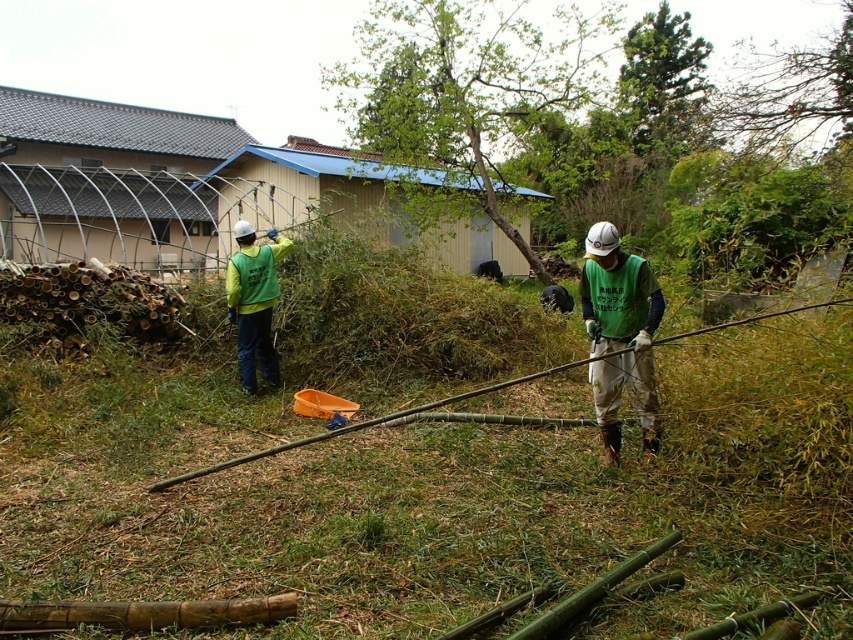
Question: Is brown textured tree at upper right further to the viewer compared to green fabric vest at left?

Choices:
 (A) yes
 (B) no

Answer: (A)

Question: Which point is farther to the camera?

Choices:
 (A) (837, 36)
 (B) (274, 272)
 (C) (676, 614)

Answer: (A)

Question: Which point is closer to the camera?

Choices:
 (A) brown textured tree at upper right
 (B) green fabric vest at center

Answer: (B)

Question: In this image, where is green fabric vest at center located relative to brown textured tree at upper right?

Choices:
 (A) below
 (B) above

Answer: (A)

Question: Which point is farther to the camera?

Choices:
 (A) (593, 269)
 (B) (547, 280)

Answer: (B)

Question: Is green grass at center below green fabric vest at center?

Choices:
 (A) no
 (B) yes

Answer: (B)